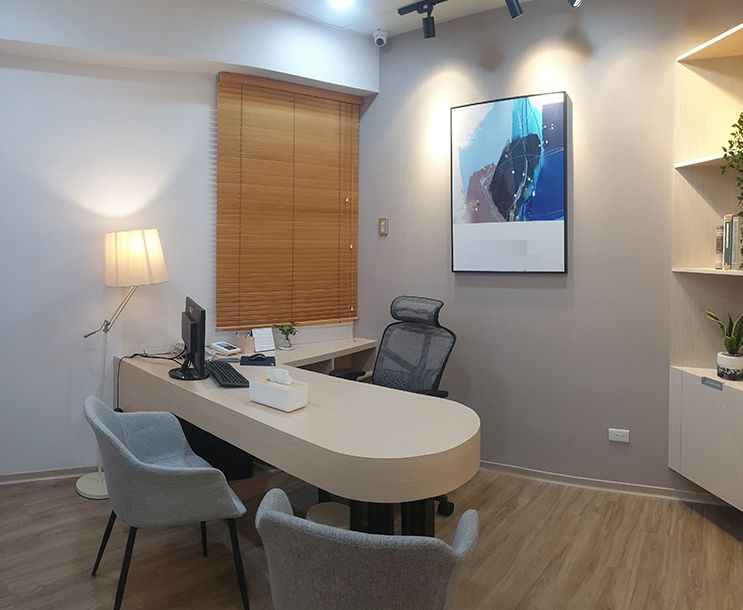
Locate an element on the screen. The image size is (743, 610). ceiling is located at coordinates (376, 5).